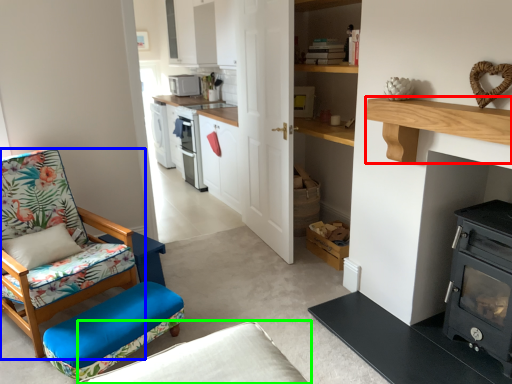
Question: Which object is the farthest from shelf (highlighted by a red box)? Choose among these: chair (highlighted by a blue box) or studio couch (highlighted by a green box).

Choices:
 (A) chair
 (B) studio couch

Answer: (A)